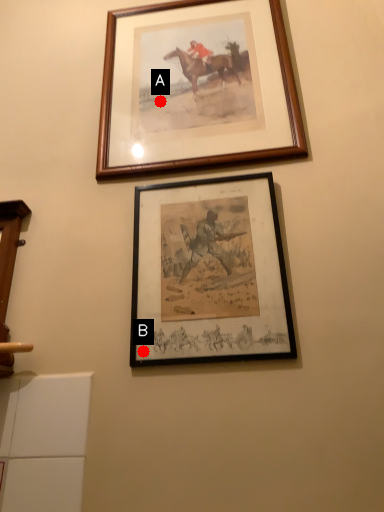
Question: Two points are circled on the image, labeled by A and B beside each circle. Which point is closer to the camera?

Choices:
 (A) A is closer
 (B) B is closer

Answer: (B)